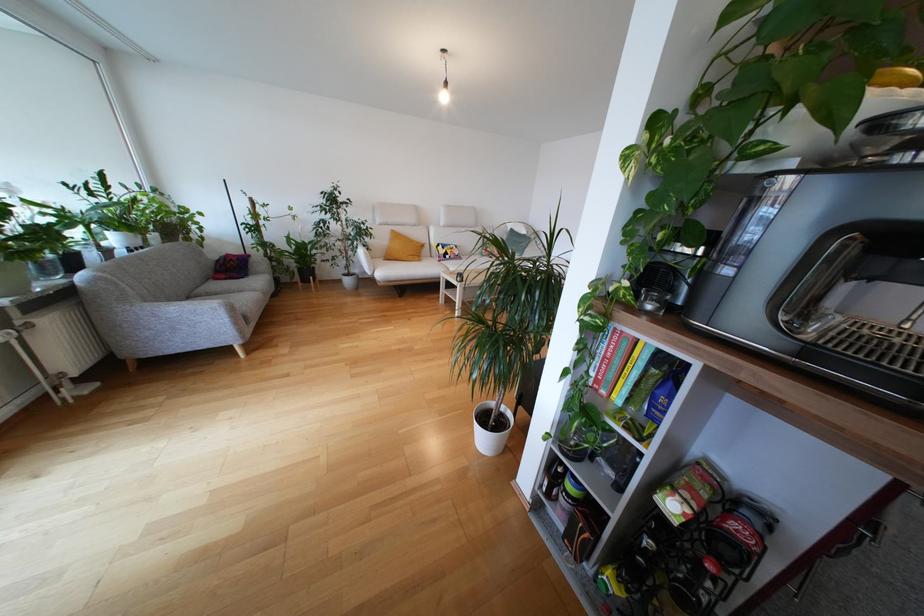
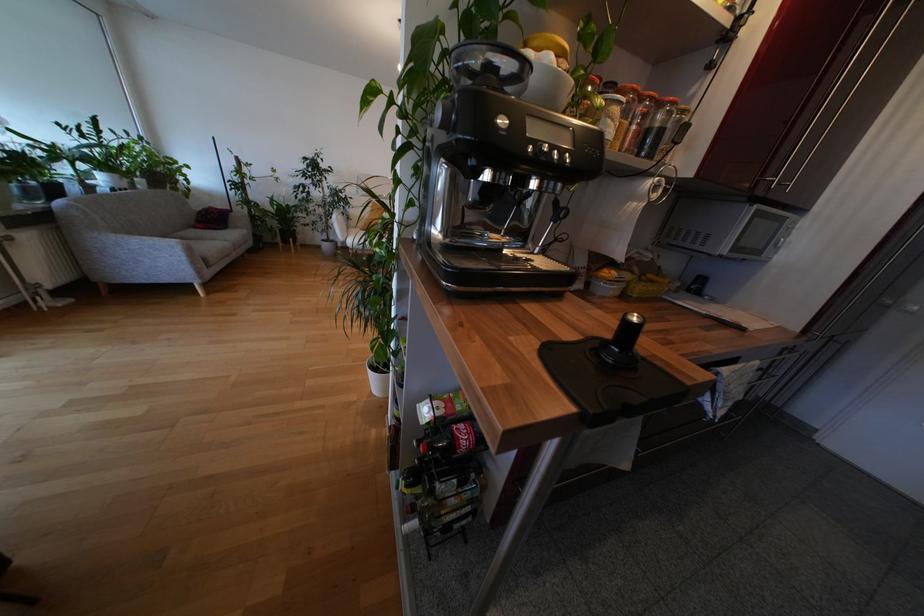
The point at (236,312) is marked in the first image. Where is the corresponding point in the second image?

(192, 252)